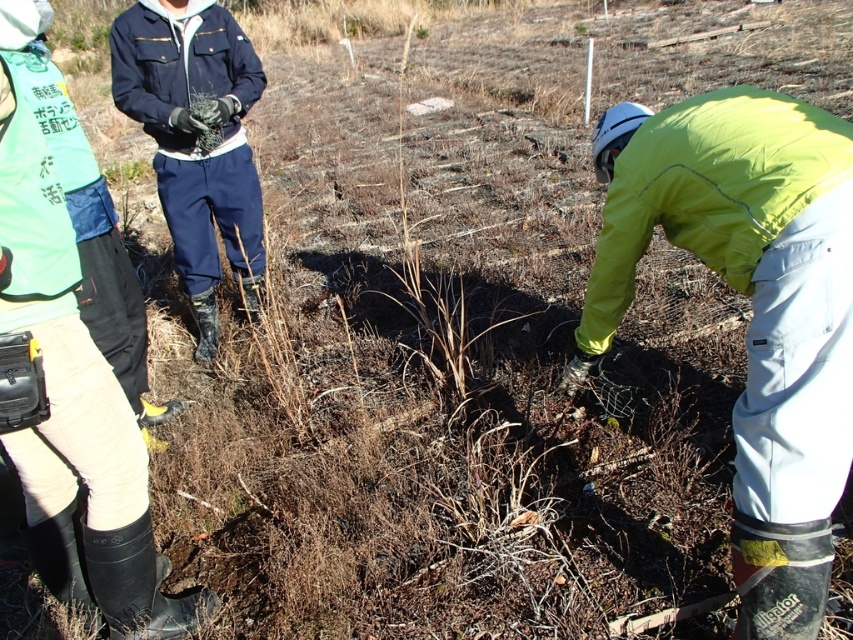
You are a field assistant observing the scene. You need to approach both the neon yellow jacket at lower right and the matte black rubber boots at lower left. Which object should you approach first to reach the one closer to you?

You should approach the neon yellow jacket at lower right first because it is closer to you than the matte black rubber boots at lower left.

You are a researcher standing at the center of the image. You need to locate the matte black rubber boots at lower left. According to the coordinates provided, where exactly should you look to find them?

The matte black rubber boots at lower left are located at coordinates point (74, 413).

You are a field assistant observing the scene. You need to locate the neon yellow jacket at lower right and the matte black rubber boots at lower left. Based on their positions, which object is higher up in the image?

The neon yellow jacket at lower right is located above the matte black rubber boots at lower left in the image.